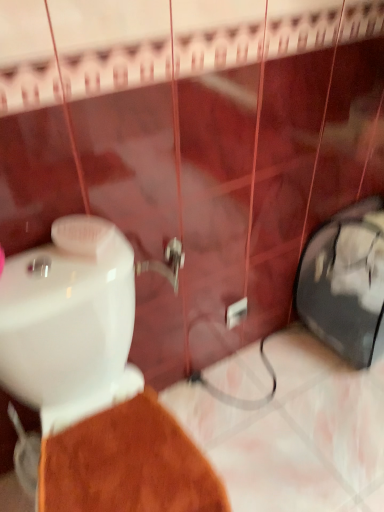
Question: Does point (233, 323) appear closer or farther from the camera than point (84, 253)?

Choices:
 (A) farther
 (B) closer

Answer: (A)

Question: Considering the relative positions of white plastic electric outlet at center and white glossy toilet at lower left in the image provided, is white plastic electric outlet at center to the left or to the right of white glossy toilet at lower left?

Choices:
 (A) left
 (B) right

Answer: (B)

Question: Is white plastic electric outlet at center taller or shorter than white glossy toilet at lower left?

Choices:
 (A) short
 (B) tall

Answer: (A)

Question: Looking at their shapes, would you say white glossy toilet at lower left is wider or thinner than white plastic electric outlet at center?

Choices:
 (A) wide
 (B) thin

Answer: (A)

Question: Is white glossy toilet at lower left in front of or behind white plastic electric outlet at center in the image?

Choices:
 (A) front
 (B) behind

Answer: (A)

Question: From a real-world perspective, is white glossy toilet at lower left positioned above or below white plastic electric outlet at center?

Choices:
 (A) above
 (B) below

Answer: (A)

Question: Is white glossy toilet at lower left to the left or to the right of white plastic electric outlet at center in the image?

Choices:
 (A) right
 (B) left

Answer: (B)